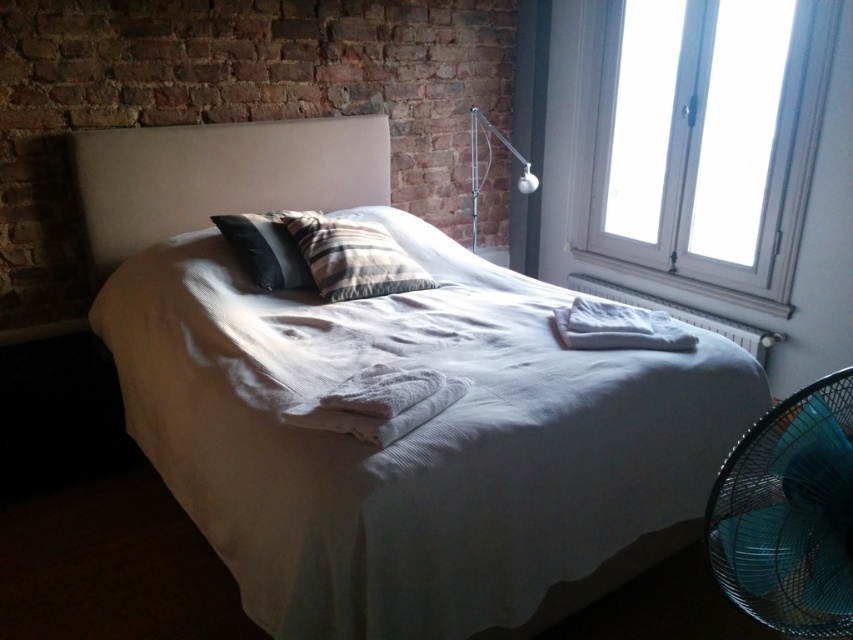
From the picture: You are a delivery person who needs to place a large package on the floor next to the bed. Considering the white cotton bed at center and the white fabric headboard at upper center, which object should you avoid placing the package near to ensure there is enough space?

You should avoid placing the package near the white cotton bed at center because it is larger in size than the white fabric headboard at upper center, meaning there is less space around the bed compared to the area near the headboard.

You are trying to decide where to place a new decorative item in the bedroom. The item is larger than the white textured towels at center but smaller than the white fabric headboard at upper center. Based on the scene, where could you place the item without it being too large for the space?

The item could be placed near the white fabric headboard at upper center since it is larger than the white textured towels at center, providing enough space for the new decorative item.